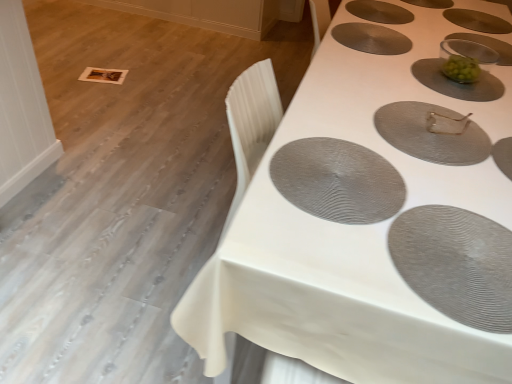
This screenshot has width=512, height=384. I want to click on vacant area on top of textured gray oval at center, the 6th oval in the back-to-front sequence (from a real-world perspective), so (331, 167).